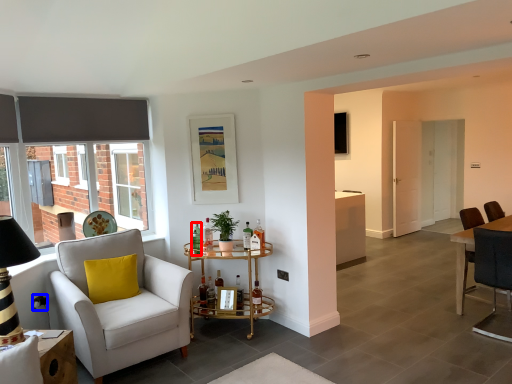
Question: Which object is further to the camera taking this photo, bottle (highlighted by a red box) or power outlet (highlighted by a blue box)?

Choices:
 (A) bottle
 (B) power outlet

Answer: (A)